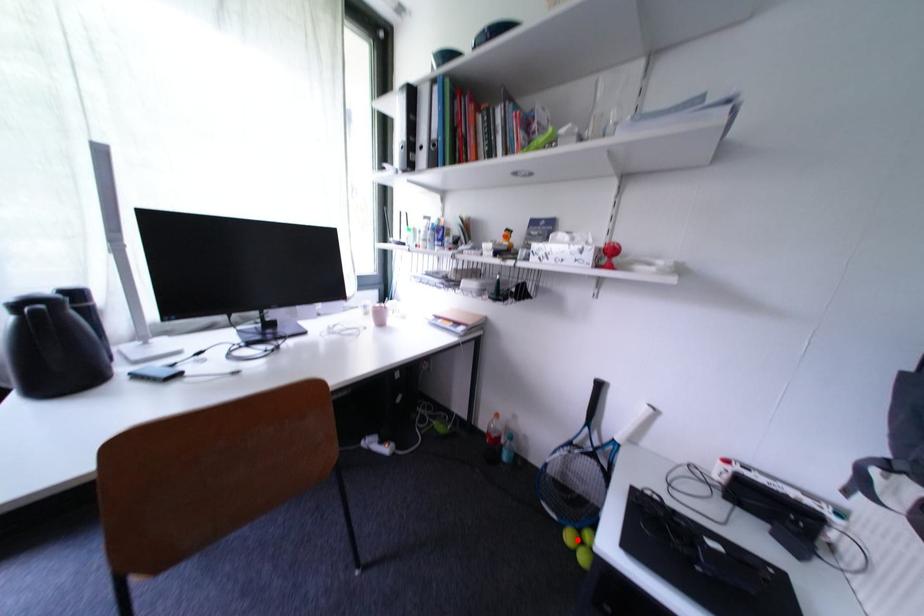
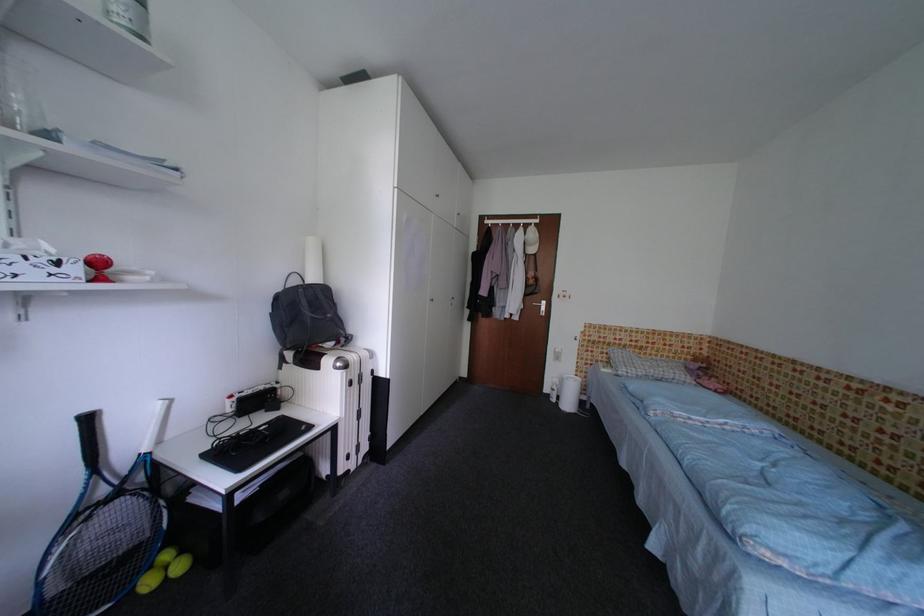
In the second image, find the point that corresponds to the highlighted location in the first image.

(156, 586)